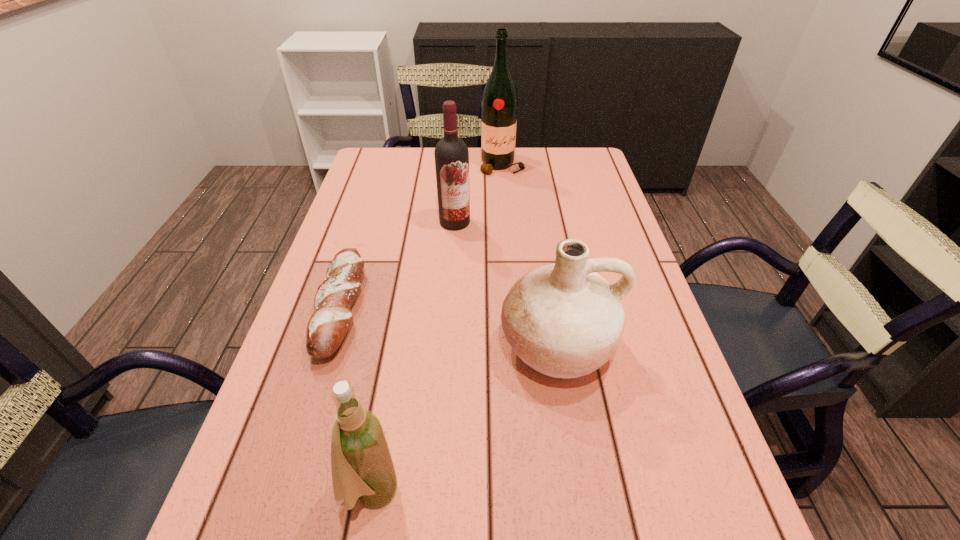
The image size is (960, 540). In order to click on object that can be found as the fourth closest to the second wine bottle from right to left in this screenshot , I will do `click(362, 467)`.

In order to click on wine bottle that is the closest to the fourth nearest object in this screenshot , I will do `click(499, 101)`.

Select which wine bottle is the third closest to the pottery. Please provide its 2D coordinates. Your answer should be formatted as a tuple, i.e. [(x, y)], where the tuple contains the x and y coordinates of a point satisfying the conditions above.

[(499, 101)]